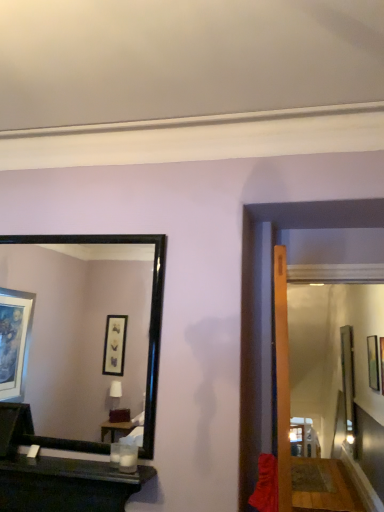
Question: Is black glossy mirror at upper left looking in the opposite direction of metallic silver picture frame at upper right?

Choices:
 (A) no
 (B) yes

Answer: (A)

Question: From the image's perspective, is black glossy mirror at upper left located beneath metallic silver picture frame at upper right?

Choices:
 (A) yes
 (B) no

Answer: (B)

Question: Is black glossy mirror at upper left located outside metallic silver picture frame at upper right?

Choices:
 (A) yes
 (B) no

Answer: (A)

Question: Does black glossy mirror at upper left have a greater height compared to metallic silver picture frame at upper right?

Choices:
 (A) no
 (B) yes

Answer: (B)

Question: Can you confirm if black glossy mirror at upper left is shorter than metallic silver picture frame at upper right?

Choices:
 (A) yes
 (B) no

Answer: (B)

Question: From a real-world perspective, is black glossy mirror at upper left located beneath metallic silver picture frame at upper right?

Choices:
 (A) no
 (B) yes

Answer: (A)

Question: Can black glossy mirror at upper left be found inside metallic silver picture frame at upper right?

Choices:
 (A) no
 (B) yes

Answer: (A)

Question: Does metallic silver picture frame at upper right have a greater height compared to black glossy mirror at upper left?

Choices:
 (A) no
 (B) yes

Answer: (A)

Question: Does metallic silver picture frame at upper right lie in front of black glossy mirror at upper left?

Choices:
 (A) yes
 (B) no

Answer: (B)

Question: Considering the relative sizes of metallic silver picture frame at upper right and black glossy mirror at upper left in the image provided, is metallic silver picture frame at upper right smaller than black glossy mirror at upper left?

Choices:
 (A) yes
 (B) no

Answer: (A)

Question: Is metallic silver picture frame at upper right thinner than black glossy mirror at upper left?

Choices:
 (A) yes
 (B) no

Answer: (A)

Question: Would you say metallic silver picture frame at upper right is a long distance from black glossy mirror at upper left?

Choices:
 (A) no
 (B) yes

Answer: (B)

Question: From the image's perspective, is metallic silver picture frame at upper right above or below black glossy mirror at upper left?

Choices:
 (A) below
 (B) above

Answer: (A)